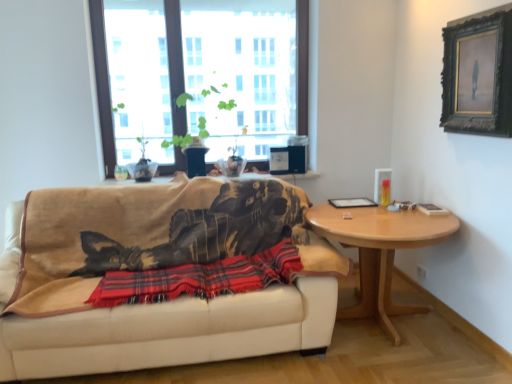
Question: Should I look upward or downward to see transparent glass window at upper center?

Choices:
 (A) down
 (B) up

Answer: (B)

Question: Is black wooden picture frame at upper right aimed at transparent glass window at upper center?

Choices:
 (A) yes
 (B) no

Answer: (B)

Question: Considering the relative sizes of black wooden picture frame at upper right and transparent glass window at upper center in the image provided, is black wooden picture frame at upper right taller than transparent glass window at upper center?

Choices:
 (A) yes
 (B) no

Answer: (B)

Question: Considering the relative sizes of black wooden picture frame at upper right and transparent glass window at upper center in the image provided, is black wooden picture frame at upper right bigger than transparent glass window at upper center?

Choices:
 (A) yes
 (B) no

Answer: (B)

Question: From a real-world perspective, is black wooden picture frame at upper right beneath transparent glass window at upper center?

Choices:
 (A) yes
 (B) no

Answer: (B)

Question: Does black wooden picture frame at upper right have a lesser height compared to transparent glass window at upper center?

Choices:
 (A) yes
 (B) no

Answer: (A)

Question: From a real-world perspective, is black wooden picture frame at upper right positioned over transparent glass window at upper center based on gravity?

Choices:
 (A) yes
 (B) no

Answer: (A)

Question: Does green matte plant at upper center touch red plaid blanket at center?

Choices:
 (A) yes
 (B) no

Answer: (B)

Question: Is green matte plant at upper center to the right of red plaid blanket at center from the viewer's perspective?

Choices:
 (A) yes
 (B) no

Answer: (B)

Question: Would you say green matte plant at upper center contains red plaid blanket at center?

Choices:
 (A) yes
 (B) no

Answer: (B)

Question: Can you confirm if green matte plant at upper center is positioned to the left of red plaid blanket at center?

Choices:
 (A) no
 (B) yes

Answer: (B)

Question: Is green matte plant at upper center bigger than red plaid blanket at center?

Choices:
 (A) yes
 (B) no

Answer: (A)

Question: Considering the relative sizes of green matte plant at upper center and red plaid blanket at center in the image provided, is green matte plant at upper center thinner than red plaid blanket at center?

Choices:
 (A) no
 (B) yes

Answer: (A)

Question: From a real-world perspective, is beige fabric couch at center physically above black wooden picture frame at upper right?

Choices:
 (A) yes
 (B) no

Answer: (B)